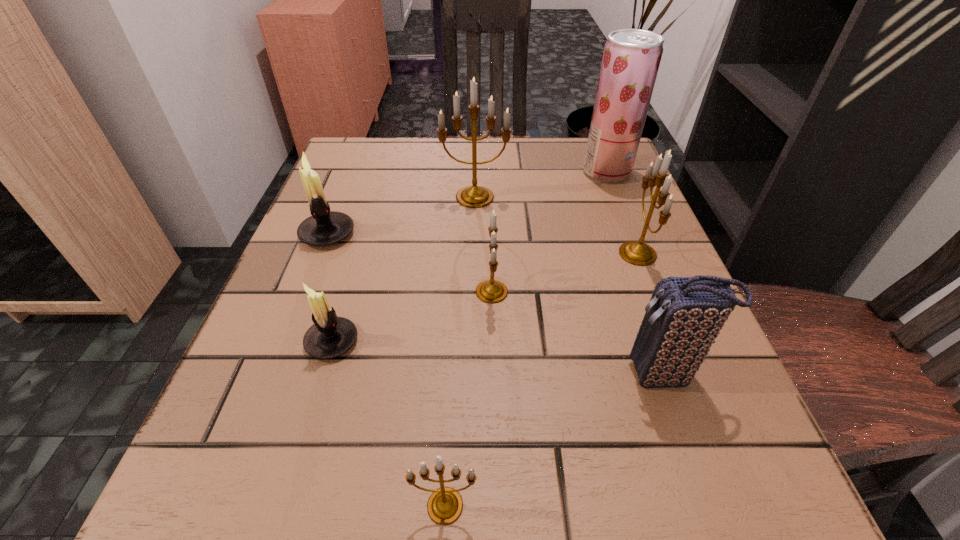
Locate an element on the screen. This screenshot has width=960, height=540. gold candelabrum that is the fourth closest to the strawberry fruit juice is located at coordinates (445, 505).

Locate which gold candelabrum is the fourth closest to the bigger white candle holder. Please provide its 2D coordinates. Your answer should be formatted as a tuple, i.e. [(x, y)], where the tuple contains the x and y coordinates of a point satisfying the conditions above.

[(638, 253)]